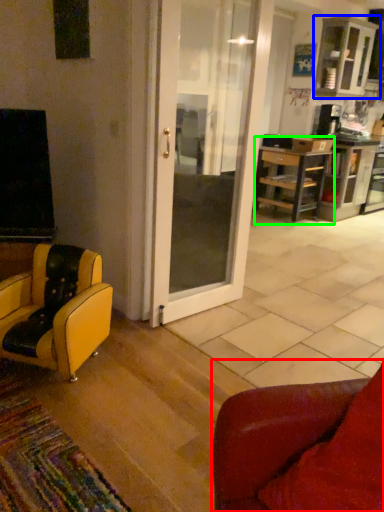
Question: Which is farther away from chair (highlighted by a red box)? cabinetry (highlighted by a blue box) or desk (highlighted by a green box)?

Choices:
 (A) cabinetry
 (B) desk

Answer: (A)